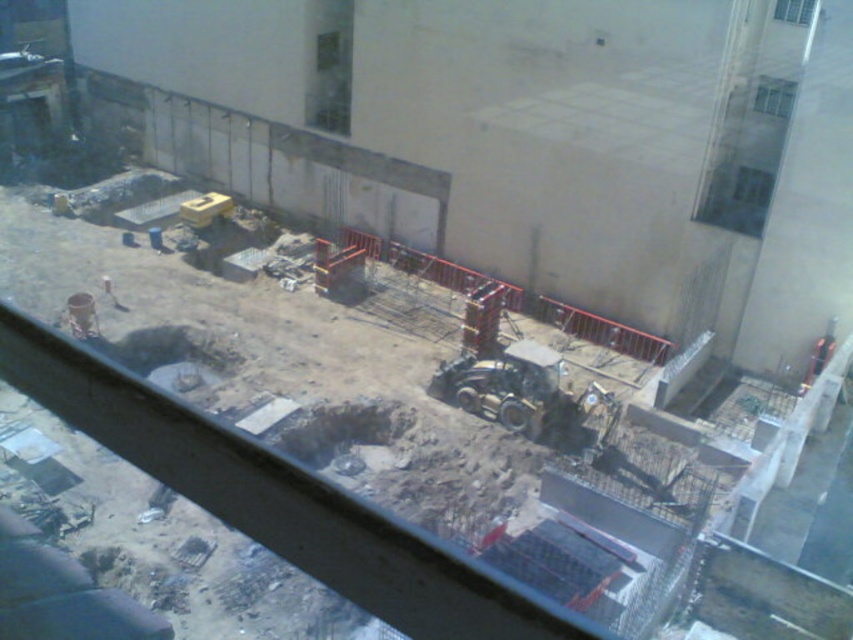
Is clear glass window at upper right to the left of transparent glass window at upper right from the viewer's perspective?

Correct, you'll find clear glass window at upper right to the left of transparent glass window at upper right.

Which is below, clear glass window at upper right or transparent glass window at upper right?

clear glass window at upper right

This screenshot has height=640, width=853. What do you see at coordinates (773, 97) in the screenshot?
I see `clear glass window at upper right` at bounding box center [773, 97].

Locate an element on the screen. The height and width of the screenshot is (640, 853). clear glass window at upper right is located at coordinates (773, 97).

Does metallic yellow tractor at center have a smaller size compared to transparent glass window at upper right?

Yes, metallic yellow tractor at center is smaller than transparent glass window at upper right.

Is the position of metallic yellow tractor at center more distant than that of transparent glass window at upper right?

That is True.

This screenshot has width=853, height=640. Identify the location of metallic yellow tractor at center. (519, 381).

Can you confirm if transparent glass window at upper center is positioned to the left of clear glass window at upper right?

Indeed, transparent glass window at upper center is positioned on the left side of clear glass window at upper right.

Is transparent glass window at upper center below clear glass window at upper right?

No, transparent glass window at upper center is not below clear glass window at upper right.

The height and width of the screenshot is (640, 853). Describe the element at coordinates (329, 65) in the screenshot. I see `transparent glass window at upper center` at that location.

Locate an element on the screen. transparent glass window at upper center is located at coordinates (329, 65).